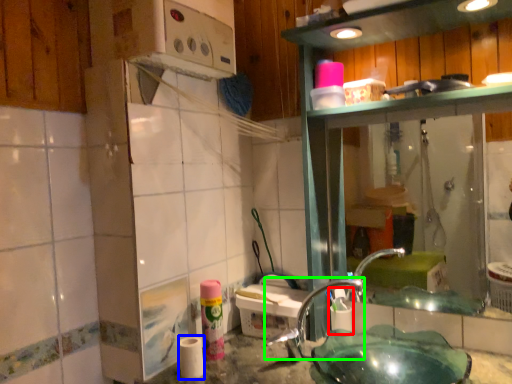
Question: Which is farther away from shaving cream (highlighted by a red box)? toilet paper (highlighted by a blue box) or faucet (highlighted by a green box)?

Choices:
 (A) toilet paper
 (B) faucet

Answer: (A)